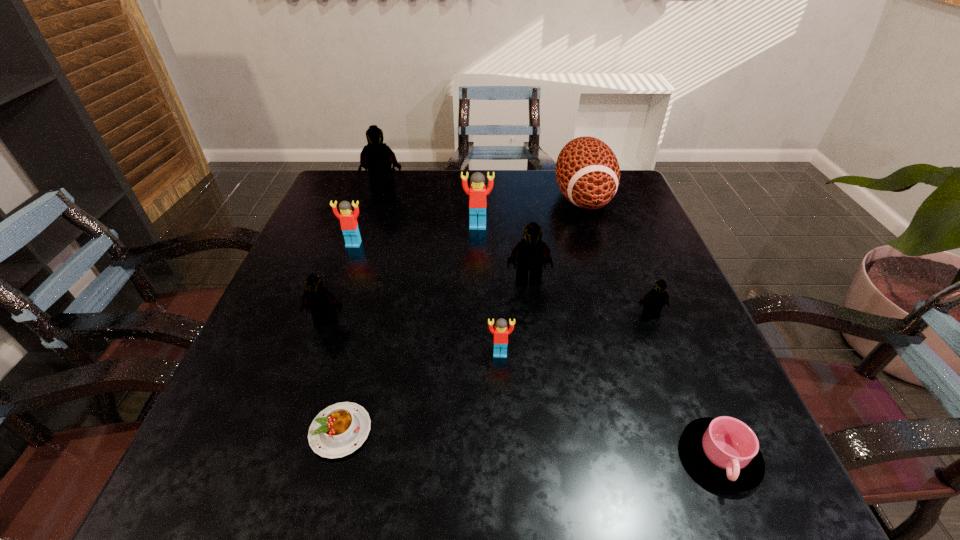
Locate an element on the screen. The height and width of the screenshot is (540, 960). object that is the sixth closest to the second smallest black Lego is located at coordinates click(376, 157).

Select which Lego appears as the sixth closest to the biggest red Lego. Please provide its 2D coordinates. Your answer should be formatted as a tuple, i.e. [(x, y)], where the tuple contains the x and y coordinates of a point satisfying the conditions above.

[(654, 300)]

Identify which Lego is the second closest to the rightmost black Lego. Please provide its 2D coordinates. Your answer should be formatted as a tuple, i.e. [(x, y)], where the tuple contains the x and y coordinates of a point satisfying the conditions above.

[(501, 331)]

The height and width of the screenshot is (540, 960). Find the location of `black Lego identified as the fourth closest to the farthest red Lego`. black Lego identified as the fourth closest to the farthest red Lego is located at coordinates (654, 300).

Identify the location of black Lego that stands as the third closest to the second smallest black Lego. The width and height of the screenshot is (960, 540). (654, 300).

Identify which red Lego is the second closest to the nearest red Lego. Please provide its 2D coordinates. Your answer should be formatted as a tuple, i.e. [(x, y)], where the tuple contains the x and y coordinates of a point satisfying the conditions above.

[(348, 219)]

Select which red Lego appears as the closest to the second smallest black Lego. Please provide its 2D coordinates. Your answer should be formatted as a tuple, i.e. [(x, y)], where the tuple contains the x and y coordinates of a point satisfying the conditions above.

[(348, 219)]